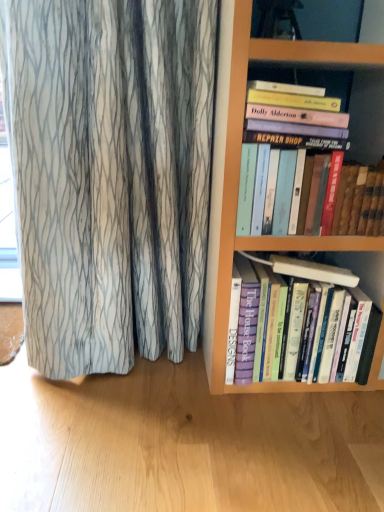
Where is `blank area to the left of purple hardcover book at center, the second book when ordered from top to bottom`? blank area to the left of purple hardcover book at center, the second book when ordered from top to bottom is located at coordinates (173, 386).